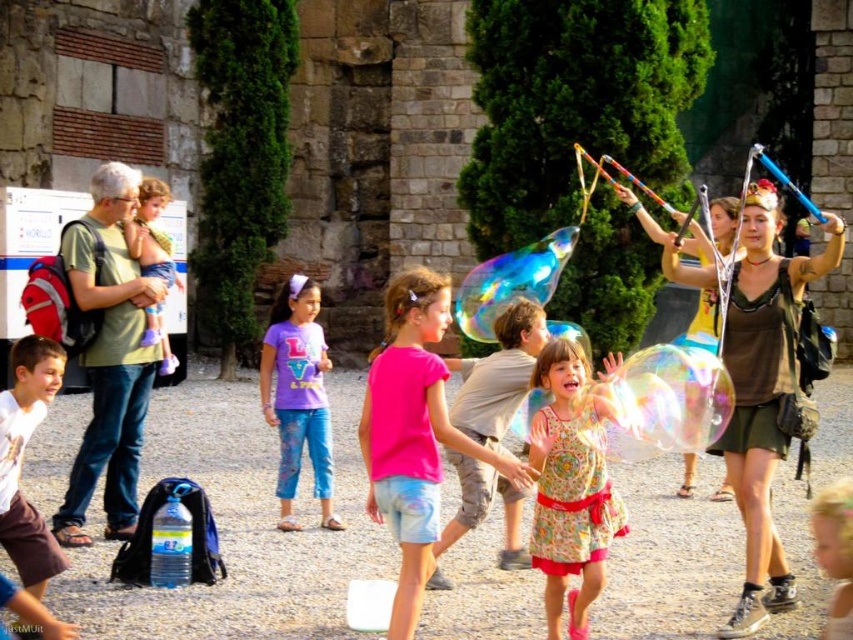
You are a photographer trying to capture a group photo of the matte brown dress at center and the pink matte shirt at center. If you want to ensure both subjects are fully visible in the frame, which subject should you position closer to the camera to avoid cropping?

The matte brown dress at center has a larger width than the pink matte shirt at center. To ensure both are fully visible, position the matte brown dress at center closer to the camera so its wider size can fit within the frame without being cropped.

From the picture: You are a photographer trying to capture the woman in the matte brown dress at center. Given that your camera focuses best at coordinates between 0.6 and 0.9 on both axes, will the dress be in focus?

The matte brown dress at center is located at point [759,384], which falls within the camera focus range of 0.6 to 0.9 on both axes. Therefore, the dress will be in focus.

You are standing at the center of the scene and want to greet both the matte brown dress at center and the purple matte shirt at center. Which one should you walk towards first if you want to reach the closer one first?

The matte brown dress at center is 30.83 feet away from the purple matte shirt at center. Since you want to reach the closer one first, you should walk towards the purple matte shirt at center because it is closer to you than the matte brown dress at center.